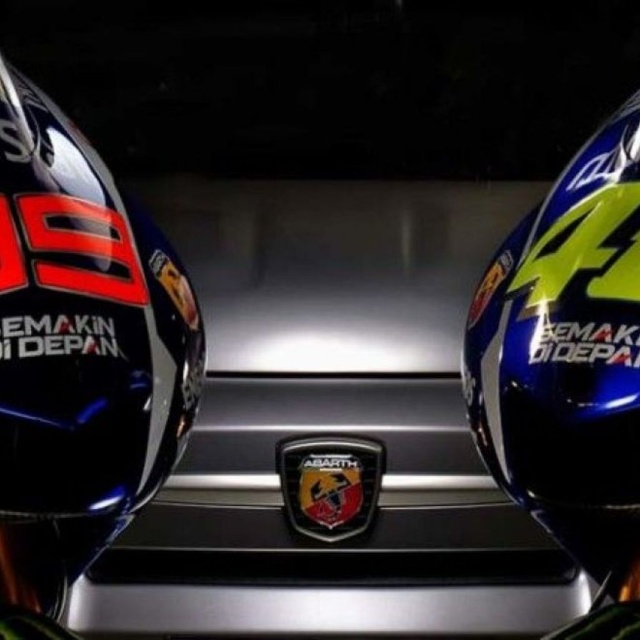
From the picture: You are a delivery person who needs to place a small package between the glossy black helmet at left and the blue glossy motorcycle helmet at right. The package is 12 inches long. Will it fit between them?

The glossy black helmet at left and blue glossy motorcycle helmet at right are 11.91 inches apart. Since the package is 12 inches long, it will not fit between them as the distance is slightly less than the package length.

You are standing in front of a car with two motorcycle helmets on either side of its grille. The left helmet has a bold red number 9 and the text EMAKIN DEPAN, while the right helmet has a bright yellow lightning bolt and the same text. You notice a point marked at coordinates (81, 352). Which helmet does this point belong to?

The point at (81, 352) belongs to the glossy black helmet at left.